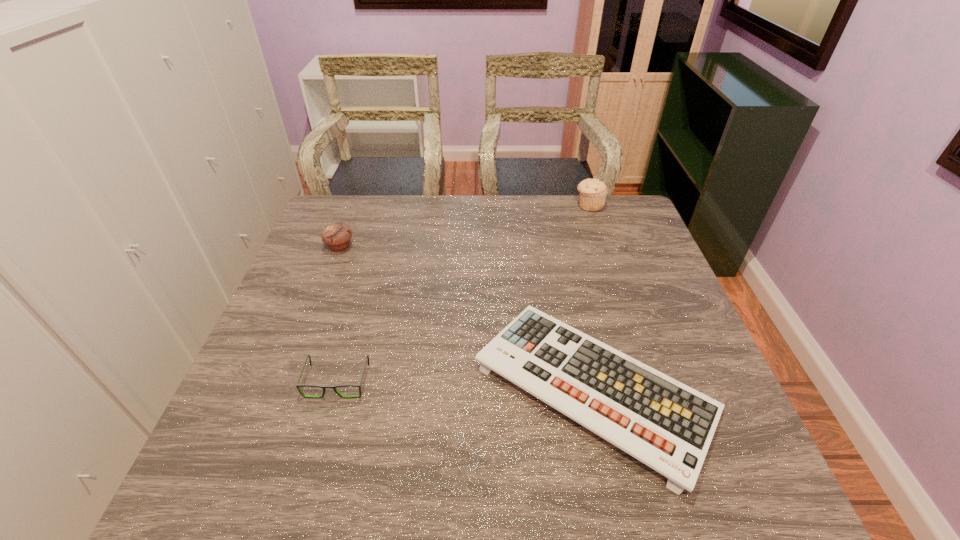
This screenshot has width=960, height=540. In the image, there is a desktop. Find the location of `vacant space at the left edge`. vacant space at the left edge is located at coordinates (273, 369).

Find the location of a particular element. This screenshot has height=540, width=960. free spot at the right edge of the desktop is located at coordinates (613, 241).

This screenshot has width=960, height=540. I want to click on free space at the near left corner of the desktop, so click(x=264, y=464).

Identify the location of blank space at the far right corner of the desktop. The image size is (960, 540). (611, 212).

The width and height of the screenshot is (960, 540). I want to click on vacant area that lies between the taller muffin and the spectacles, so click(x=464, y=293).

Where is `empty location between the computer keyboard and the left muffin`? This screenshot has width=960, height=540. empty location between the computer keyboard and the left muffin is located at coordinates (467, 317).

Find the location of a particular element. vacant area that lies between the computer keyboard and the spectacles is located at coordinates (466, 384).

Locate an element on the screen. The height and width of the screenshot is (540, 960). blank region between the spectacles and the nearer muffin is located at coordinates (339, 314).

The image size is (960, 540). In order to click on free space between the computer keyboard and the nearer muffin in this screenshot , I will do `click(467, 317)`.

This screenshot has height=540, width=960. I want to click on free spot between the tallest object and the left muffin, so click(465, 226).